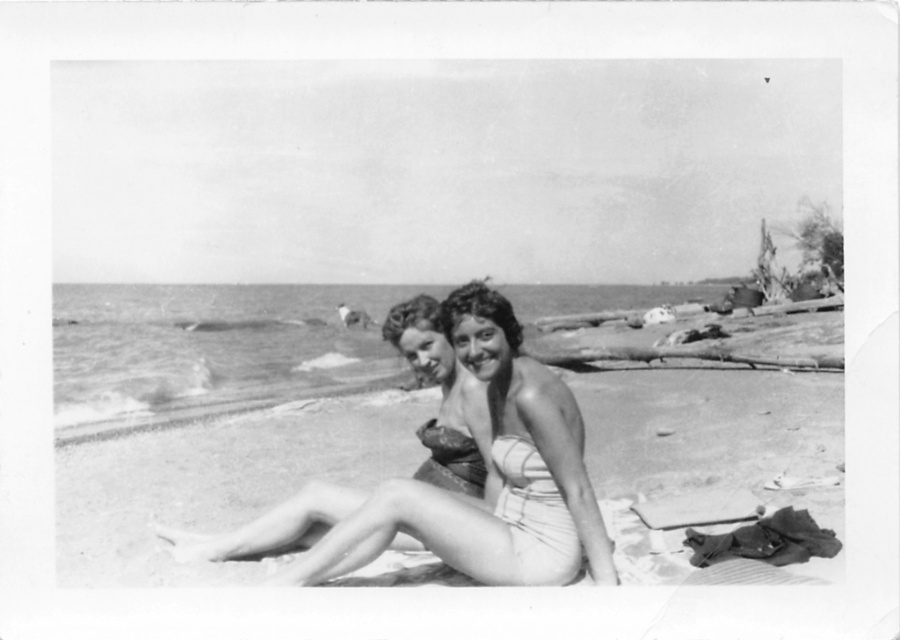
Is smooth fabric bikini at center shorter than matte fabric bikini top at center?

Incorrect, smooth fabric bikini at center's height does not fall short of matte fabric bikini top at center's.

Looking at this image, can you confirm if smooth fabric bikini at center is thinner than matte fabric bikini top at center?

Incorrect, smooth fabric bikini at center's width is not less than matte fabric bikini top at center's.

Between point (176, 506) and point (452, 484), which one is positioned behind?

The point (176, 506) is behind.

At what (x,y) coordinates should I click in order to perform the action: click on smooth fabric bikini at center. Please return your answer as a coordinate pair (x, y). The width and height of the screenshot is (900, 640). Looking at the image, I should click on (240, 433).

Does matte swimsuit at center have a greater width compared to matte fabric bikini top at center?

Indeed, matte swimsuit at center has a greater width compared to matte fabric bikini top at center.

Is matte swimsuit at center thinner than matte fabric bikini top at center?

Incorrect, matte swimsuit at center's width is not less than matte fabric bikini top at center's.

This screenshot has height=640, width=900. What are the coordinates of `matte swimsuit at center` in the screenshot? It's located at (442, 400).

Can you confirm if smooth skin bikini at center is positioned to the right of matte fabric bikini top at center?

Indeed, smooth skin bikini at center is positioned on the right side of matte fabric bikini top at center.

How distant is smooth skin bikini at center from matte fabric bikini top at center?

84.54 centimeters

Find the location of a particular element. This screenshot has height=640, width=900. smooth skin bikini at center is located at coordinates (488, 474).